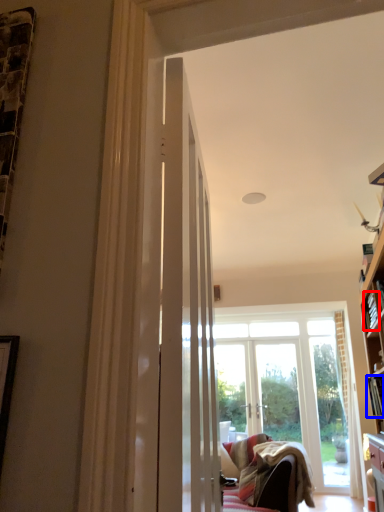
Question: Which object is further to the camera taking this photo, book (highlighted by a red box) or book (highlighted by a blue box)?

Choices:
 (A) book
 (B) book

Answer: (A)